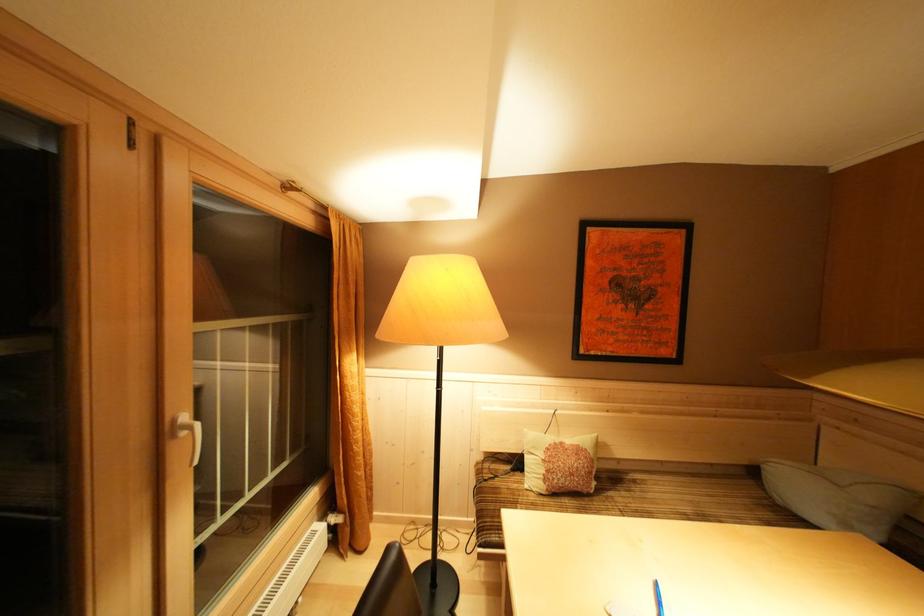
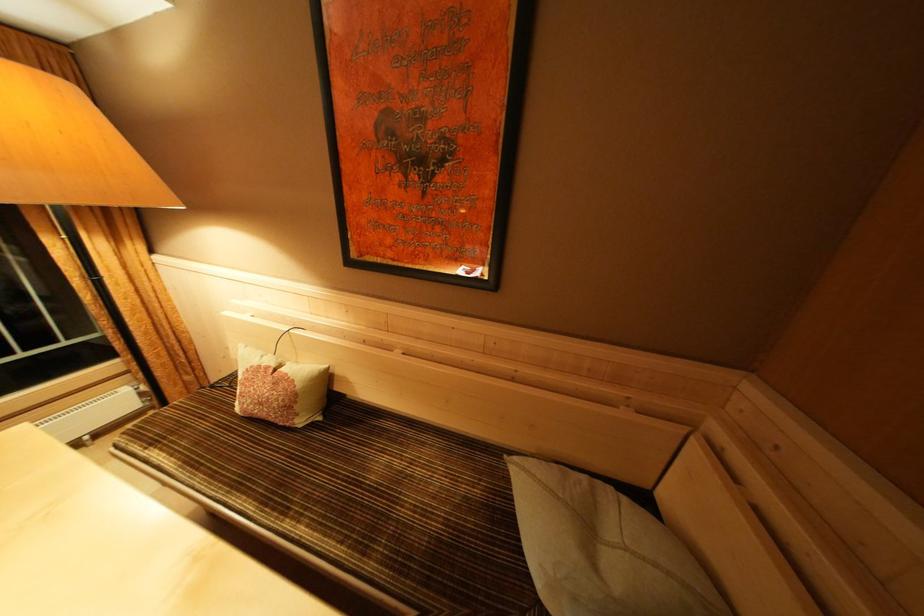
What movement of the cameraman would produce the second image?

The cameraman walked toward right, forward.